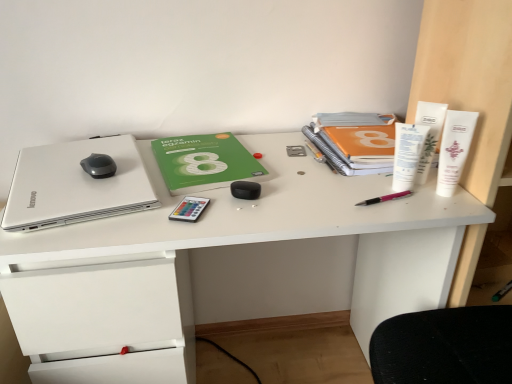
Identify the location of vacant space to the left of black plastic remote control at center-left, the 1th stationery in the left-to-right sequence. (113, 222).